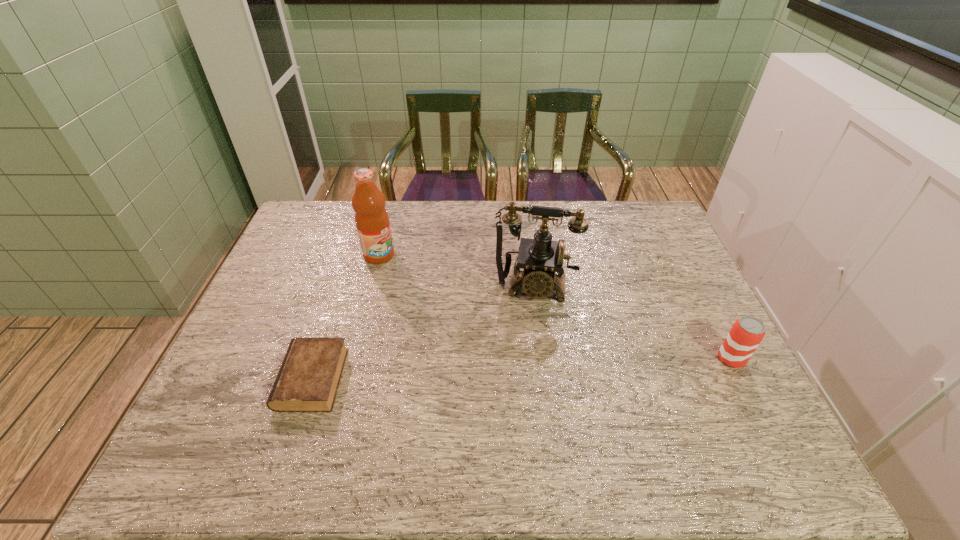
Where is `vacant space located on the front label of the fruit juice`? vacant space located on the front label of the fruit juice is located at coordinates (417, 284).

What are the coordinates of `free region located 0.180m on the front label of the fruit juice` in the screenshot? It's located at (425, 290).

Identify the location of vacant area located 0.340m on the rotary dial of the telephone. (519, 415).

At what (x,y) coordinates should I click in order to perform the action: click on blank space located 0.360m on the rotary dial of the telephone. Please return your answer as a coordinate pair (x, y). This screenshot has height=540, width=960. Looking at the image, I should click on (518, 423).

You are a GUI agent. You are given a task and a screenshot of the screen. Output one action in this format:
    pyautogui.click(x=<x>, y=<y>)
    Task: Click on the vacant region located 0.360m on the rotary dial of the telephone
    
    Given the screenshot: What is the action you would take?
    pyautogui.click(x=518, y=423)

I want to click on object situated at the near edge, so click(x=308, y=379).

The height and width of the screenshot is (540, 960). I want to click on object present at the right edge, so click(747, 332).

The height and width of the screenshot is (540, 960). Identify the location of free space at the far edge of the desktop. (422, 237).

In the image, there is a desktop. At what (x,y) coordinates should I click in order to perform the action: click on vacant space at the left edge. Please return your answer as a coordinate pair (x, y). The width and height of the screenshot is (960, 540). Looking at the image, I should click on (300, 242).

In the image, there is a desktop. At what (x,y) coordinates should I click in order to perform the action: click on vacant space at the right edge. Please return your answer as a coordinate pair (x, y). The height and width of the screenshot is (540, 960). Looking at the image, I should click on (650, 265).